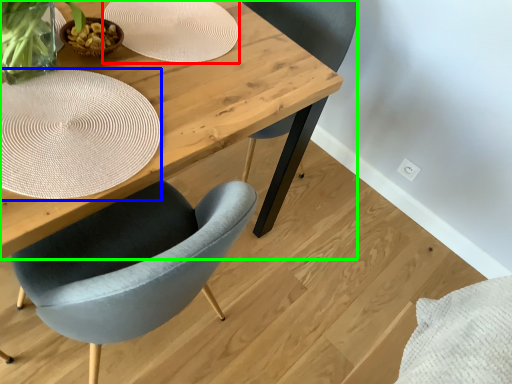
Question: Which is farther away from paper plate (highlighted by a red box)? paper plate (highlighted by a blue box) or table (highlighted by a green box)?

Choices:
 (A) paper plate
 (B) table

Answer: (A)